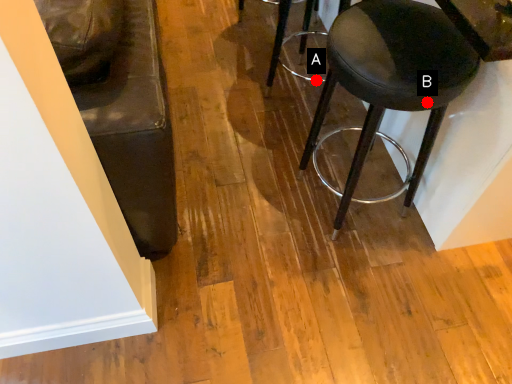
Question: Two points are circled on the image, labeled by A and B beside each circle. Which point is further to the camera?

Choices:
 (A) A is further
 (B) B is further

Answer: (A)